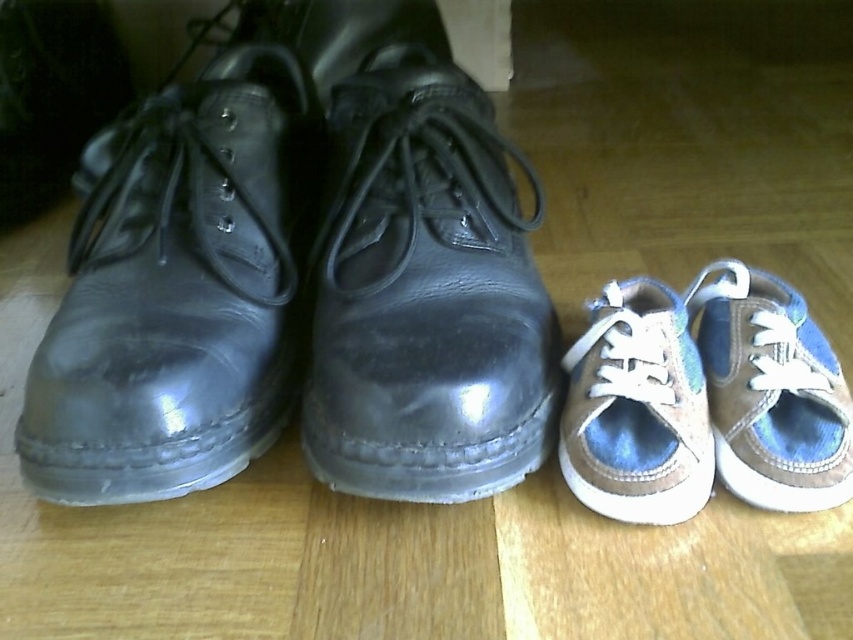
Question: Which object appears farthest from the camera in this image?

Choices:
 (A) denim fabric sneakers at right
 (B) glossy leather shoe at center
 (C) shiny black leather dress shoe at left

Answer: (A)

Question: Which of the following is the closest to the observer?

Choices:
 (A) (148, 140)
 (B) (831, 378)
 (C) (583, 481)
 (D) (547, 380)

Answer: (C)

Question: Does shiny black leather dress shoe at left have a smaller size compared to denim fabric sneakers at right?

Choices:
 (A) yes
 (B) no

Answer: (B)

Question: Is denim fabric sneakers at right below tan suede sneaker at lower right?

Choices:
 (A) yes
 (B) no

Answer: (B)

Question: Does denim fabric sneakers at right lie behind tan suede sneaker at lower right?

Choices:
 (A) no
 (B) yes

Answer: (B)

Question: Considering the real-world distances, which object is closest to the shiny black leather dress shoe at left?

Choices:
 (A) glossy leather shoe at center
 (B) denim fabric sneakers at right

Answer: (A)